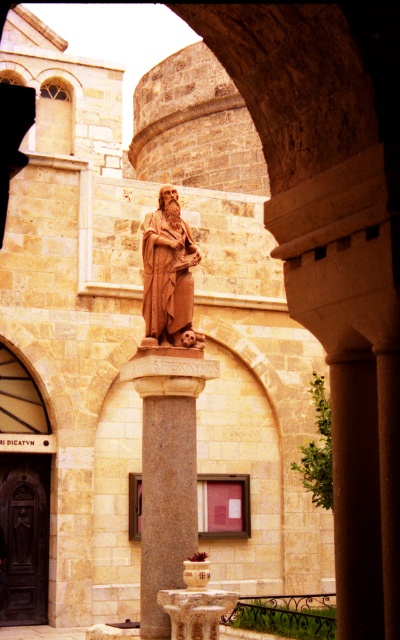
You are an architect examining the historical site. You notice the granite column at center and the brown stone statue at center. Which object is positioned lower in the scene?

The granite column at center is positioned lower than the brown stone statue at center, as it is located below it.

You are an architect visiting this historical site. You need to determine the spatial relationship between the brown stone statue at center and the white marble fountain at center. Based on the scene, which object is closer to the viewer?

The brown stone statue at center is closer to the viewer since the white marble fountain at center is positioned behind it.

You are an architect examining the historical site. You notice a point marked at coordinates (166, 490). Based on the scene, what architectural element does this point most likely represent?

The point at coordinates (166, 490) corresponds to the granite column at center.